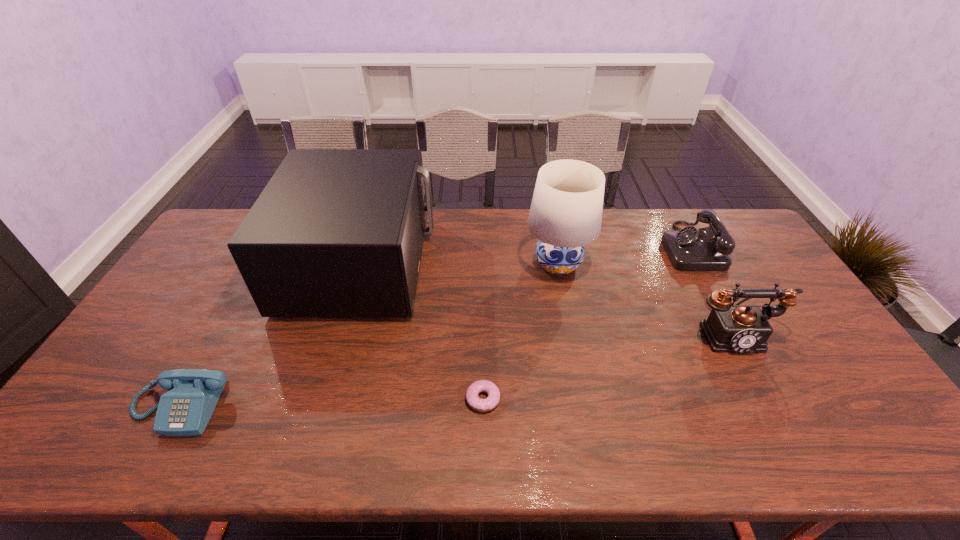
You are a GUI agent. You are given a task and a screenshot of the screen. Output one action in this format:
    pyautogui.click(x=<x>, y=<y>)
    Task: Click on the telephone that is the second nearest to the tallest telephone
    The width and height of the screenshot is (960, 540).
    Given the screenshot: What is the action you would take?
    pyautogui.click(x=185, y=410)

Where is `the second closest telephone to the fifth shortest object`? the second closest telephone to the fifth shortest object is located at coordinates (737, 328).

Image resolution: width=960 pixels, height=540 pixels. What are the coordinates of `free space that satisfies the following two spatial constraints: 1. on the front-facing side of the fourth object from left to right; 2. on the front-facing side of the microwave oven` in the screenshot? It's located at (558, 264).

This screenshot has width=960, height=540. Find the location of `vacant space that satisfies the following two spatial constraints: 1. on the dial of the fourth tallest object; 2. on the front of the tallest telephone at the rotary dial`. vacant space that satisfies the following two spatial constraints: 1. on the dial of the fourth tallest object; 2. on the front of the tallest telephone at the rotary dial is located at coordinates (736, 334).

Where is `free location that satisfies the following two spatial constraints: 1. on the front-facing side of the third object from right to left; 2. on the front-facing side of the microwave oven`? The height and width of the screenshot is (540, 960). free location that satisfies the following two spatial constraints: 1. on the front-facing side of the third object from right to left; 2. on the front-facing side of the microwave oven is located at coordinates (558, 264).

This screenshot has height=540, width=960. Identify the location of free point that satisfies the following two spatial constraints: 1. on the dial of the second tallest telephone; 2. on the dial of the nearest telephone. (777, 407).

You are a GUI agent. You are given a task and a screenshot of the screen. Output one action in this format:
    pyautogui.click(x=<x>, y=<y>)
    Task: Click on the vacant region that satisfies the following two spatial constraints: 1. on the front-facing side of the third object from right to left; 2. on the front-facing side of the microwave oven
    
    Given the screenshot: What is the action you would take?
    pyautogui.click(x=558, y=264)

Locate an element on the screen. This screenshot has height=540, width=960. vacant area in the image that satisfies the following two spatial constraints: 1. on the dial of the farthest telephone; 2. on the dial of the nearest telephone is located at coordinates (777, 407).